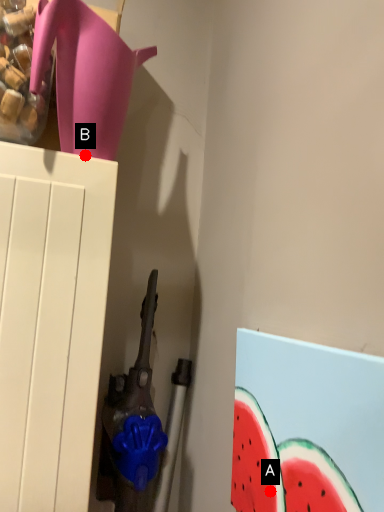
Question: Two points are circled on the image, labeled by A and B beside each circle. Which point is closer to the camera?

Choices:
 (A) A is closer
 (B) B is closer

Answer: (A)